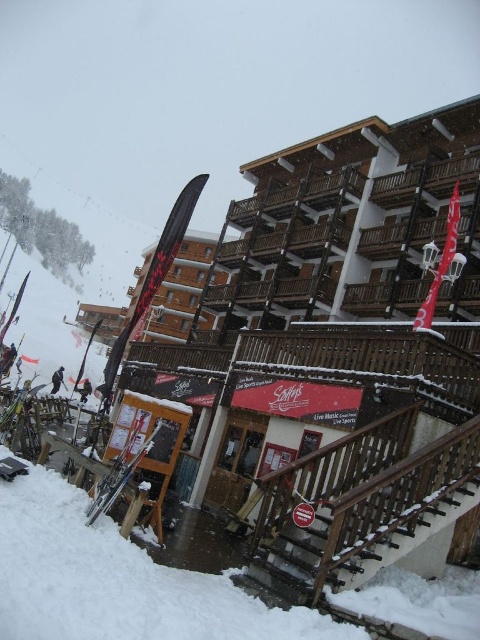
You are a snowboarder standing at the bottom of the wooden staircase leading to the ski resort building. You see a dark gray snowboarder at lower left and a dark gray ski at lower left. Which object is closer to you?

The dark gray snowboarder at lower left and dark gray ski at lower left are 17.80 feet apart from each other, so it is not possible to determine which is closer to you without additional information about their positions relative to your current location.

Consider the image. You are planning to take a photo of the dark gray snowboarder at lower left and the dark gray ski at lower left from the staircase. Which object will appear bigger in your photo?

→ The dark gray snowboarder at lower left is larger in size than the dark gray ski at lower left, so it will appear bigger in the photo.

You are a skier preparing to take your equipment up the wooden staircase. You have the metallic skis at lower left and the dark gray ski at lower left. Which one is shorter in height?

The metallic skis at lower left are not as tall as the dark gray ski at lower left, so the metallic skis at lower left are shorter in height.